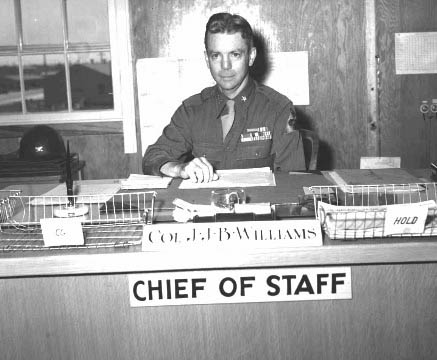
Locate an element on the screen. The width and height of the screenshot is (437, 360). light is located at coordinates (184, 62).